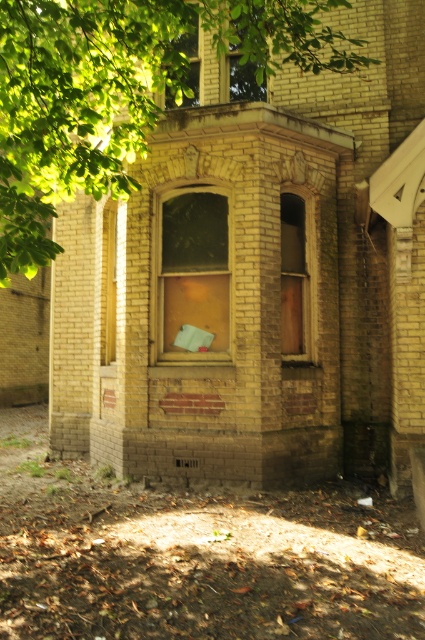
In the scene shown: Does green leafy tree at upper left have a greater height compared to wooden door at center?

Yes.

Between green leafy tree at upper left and wooden door at center, which one appears on the right side from the viewer's perspective?

Positioned to the right is wooden door at center.

Measure the distance between point [76,22] and camera.

Point [76,22] is 14.48 feet away from camera.

Where is `green leafy tree at upper left`? Image resolution: width=425 pixels, height=640 pixels. green leafy tree at upper left is located at coordinates (118, 92).

Between green leafy tree at upper left and wooden frame at upper center, which one has more height?

green leafy tree at upper left

Which is behind, point (132, 100) or point (231, 61)?

Point (231, 61)

From the picture: Who is more forward, (113, 92) or (232, 65)?

Point (113, 92)

Where is `green leafy tree at upper left`? The width and height of the screenshot is (425, 640). green leafy tree at upper left is located at coordinates (118, 92).

Does green leafy tree at upper left come in front of yellow brick window at center?

Yes, it is in front of yellow brick window at center.

Is green leafy tree at upper left shorter than yellow brick window at center?

Incorrect, green leafy tree at upper left's height does not fall short of yellow brick window at center's.

Where is `green leafy tree at upper left`? green leafy tree at upper left is located at coordinates (118, 92).

Identify the location of green leafy tree at upper left. (118, 92).